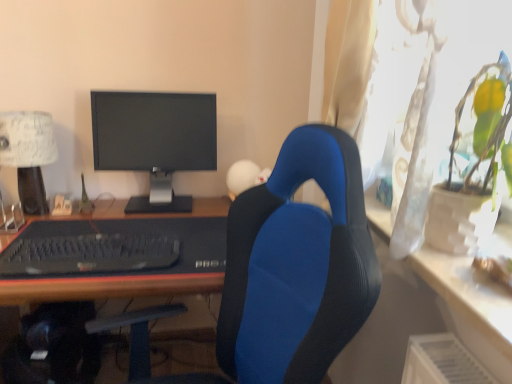
Question: Looking at their shapes, would you say matte black monitor at center is wider or thinner than black rubberized desk at center?

Choices:
 (A) wide
 (B) thin

Answer: (B)

Question: Visually, is matte black monitor at center positioned to the left or to the right of black rubberized desk at center?

Choices:
 (A) right
 (B) left

Answer: (B)

Question: Estimate the real-world distances between objects in this image. Which object is farther from the black matte keyboard at lower left?

Choices:
 (A) matte black monitor at center
 (B) black rubberized desk at center
 (C) blue fabric chair at center
 (D) white textured lampshade at left

Answer: (A)

Question: Estimate the real-world distances between objects in this image. Which object is closer to the black rubberized desk at center?

Choices:
 (A) white textured lampshade at left
 (B) black matte keyboard at lower left
 (C) blue fabric chair at center
 (D) matte black monitor at center

Answer: (D)